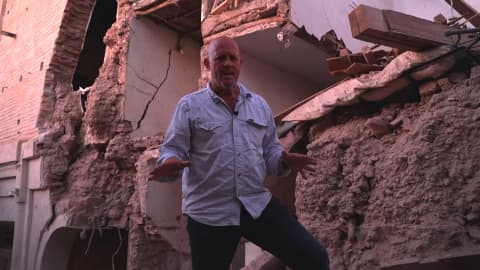
You are a GUI agent. You are given a task and a screenshot of the screen. Output one action in this format:
    pyautogui.click(x=<x>, y=<y>)
    Task: Click on the cables
    The height and width of the screenshot is (270, 480).
    Given the screenshot: What is the action you would take?
    pyautogui.click(x=122, y=240), pyautogui.click(x=92, y=237)